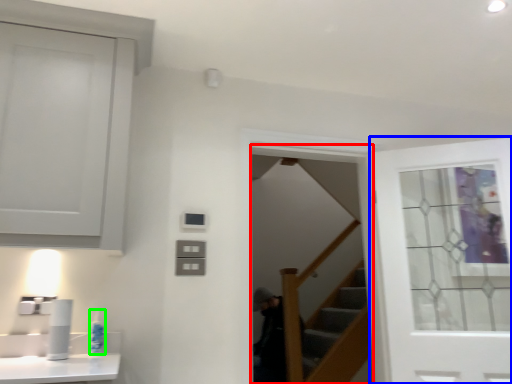
Question: Based on their relative distances, which object is farther from screen door (highlighted by a red box)? Choose from door (highlighted by a blue box) and toiletry (highlighted by a green box).

Choices:
 (A) door
 (B) toiletry

Answer: (B)